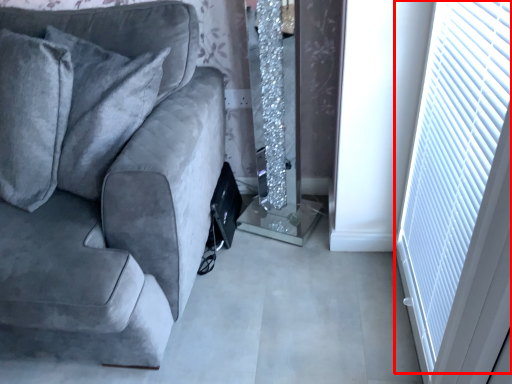
Question: Considering the relative positions of blind (annotated by the red box) and studio couch in the image provided, where is blind (annotated by the red box) located with respect to the staircase?

Choices:
 (A) left
 (B) right

Answer: (B)